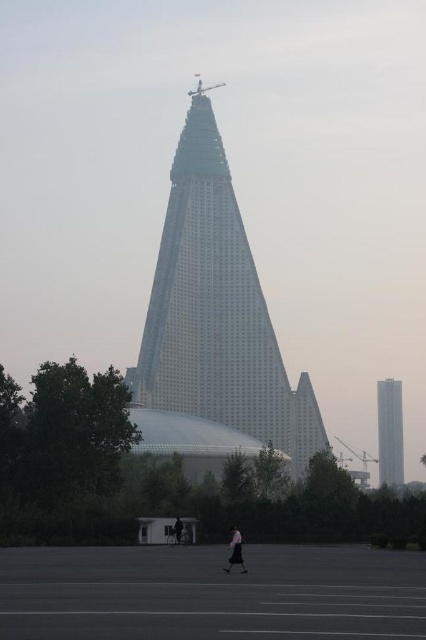
Consider the image. Who is shorter, white glass tower at right or dark gray fabric jacket at center?

Standing shorter between the two is dark gray fabric jacket at center.

Identify the location of white glass tower at right. (389, 433).

Between silver metallic pyramid at center and dark gray fabric jacket at center, which one is positioned lower?

dark gray fabric jacket at center is lower down.

Is point (198, 342) positioned before point (176, 531)?

That is True.

Find the location of a particular element. silver metallic pyramid at center is located at coordinates (216, 314).

Does light pink fabric skirt at lower center have a greater height compared to dark gray fabric jacket at center?

Correct, light pink fabric skirt at lower center is much taller as dark gray fabric jacket at center.

I want to click on light pink fabric skirt at lower center, so click(x=236, y=550).

Measure the distance between light pink fabric skirt at lower center and camera.

light pink fabric skirt at lower center and camera are 563.54 meters apart.

The width and height of the screenshot is (426, 640). I want to click on light pink fabric skirt at lower center, so click(236, 550).